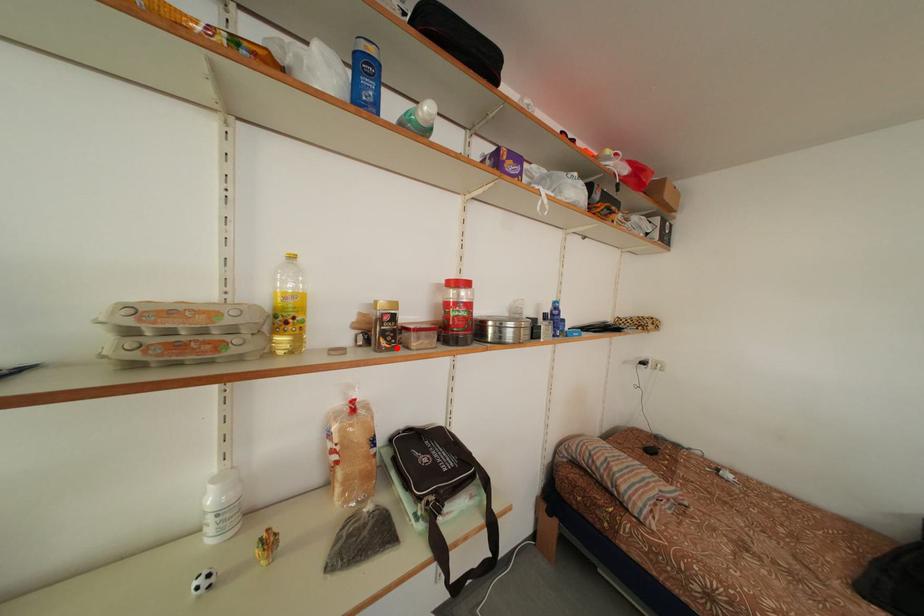
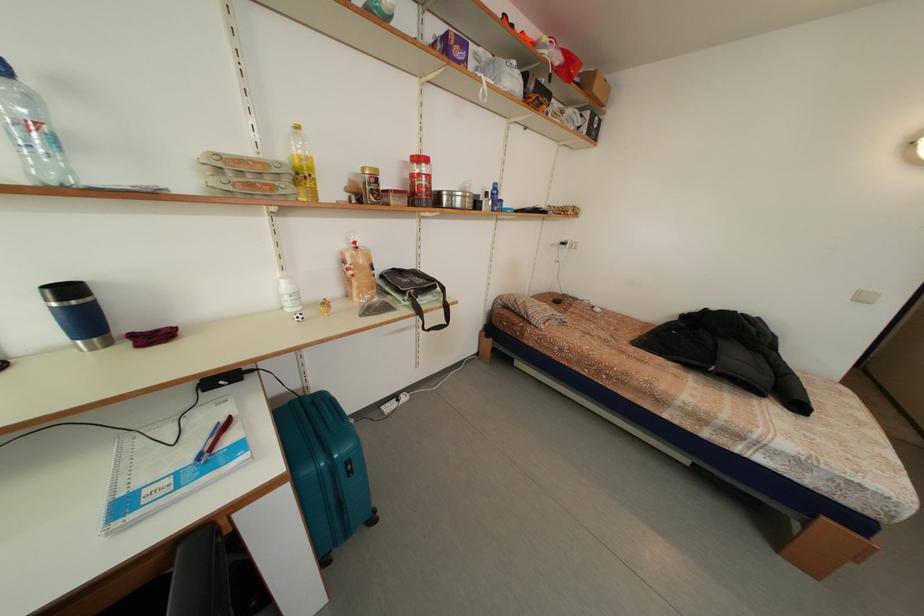
In the second image, find the point that corresponds to the highlighted location in the first image.

(383, 204)